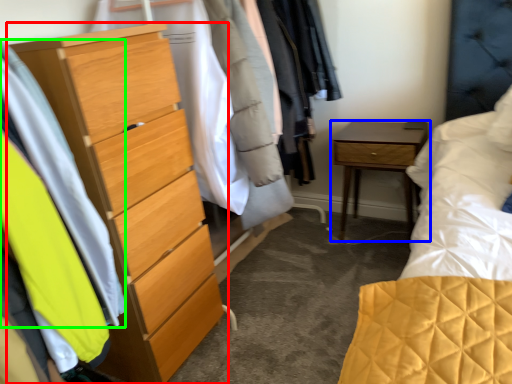
Question: Estimate the real-world distances between objects in this image. Which object is farther from chest of drawers (highlighted by a red box), nightstand (highlighted by a blue box) or clothing (highlighted by a green box)?

Choices:
 (A) nightstand
 (B) clothing

Answer: (A)